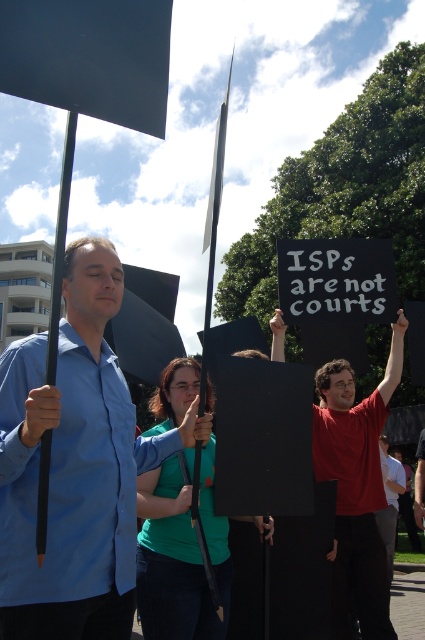
Question: Is blue fabric shirt at center to the right of matte black sign at center from the viewer's perspective?

Choices:
 (A) no
 (B) yes

Answer: (A)

Question: Which object appears farthest from the camera in this image?

Choices:
 (A) blue fabric shirt at center
 (B) matte red shirt at center
 (C) matte black sign at center

Answer: (B)

Question: Which of the following is the farthest from the observer?

Choices:
 (A) (374, 406)
 (B) (22, 392)

Answer: (A)

Question: Can you confirm if blue fabric shirt at center is bigger than matte red shirt at center?

Choices:
 (A) no
 (B) yes

Answer: (B)

Question: Is matte black sign at center smaller than matte red shirt at center?

Choices:
 (A) yes
 (B) no

Answer: (B)

Question: Among these points, which one is farthest from the camera?

Choices:
 (A) (382, 456)
 (B) (110, 611)

Answer: (A)